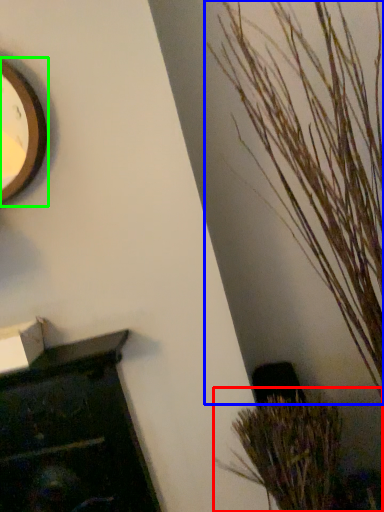
Question: Which is farther away from houseplant (highlighted by a red box)? houseplant (highlighted by a blue box) or clock (highlighted by a green box)?

Choices:
 (A) houseplant
 (B) clock

Answer: (B)